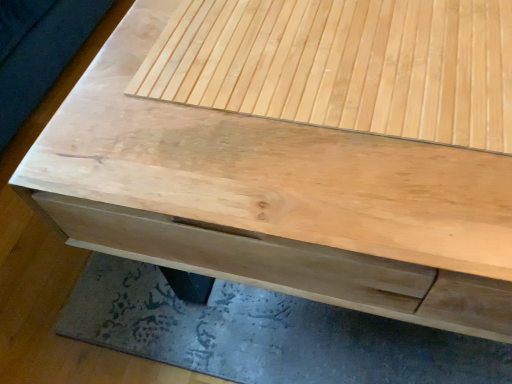
In order to face natural wood plywood at upper center, should I rotate leftwards or rightwards?

You should look right and rotate roughly 10.032 degrees.

At what (x,y) coordinates should I click in order to perform the action: click on natural wood plywood at upper center. Please return your answer as a coordinate pair (x, y). Looking at the image, I should click on (345, 65).

Describe the element at coordinates (345, 65) in the screenshot. I see `natural wood plywood at upper center` at that location.

At what (x,y) coordinates should I click in order to perform the action: click on natural wood plywood at upper center. Please return your answer as a coordinate pair (x, y). Looking at the image, I should click on (345, 65).